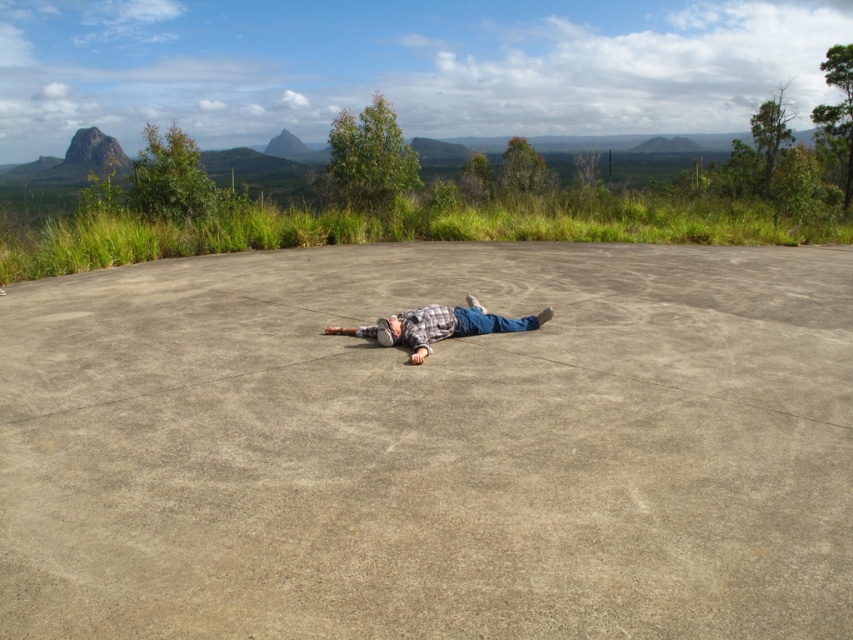
Is point (527, 282) closer to camera compared to point (405, 333)?

No, it is behind (405, 333).

Is gray concrete at center taller than plaid shirt at center?

Correct, gray concrete at center is much taller as plaid shirt at center.

At what (x,y) coordinates should I click in order to perform the action: click on gray concrete at center. Please return your answer as a coordinate pair (x, y). This screenshot has width=853, height=640. Looking at the image, I should click on (431, 445).